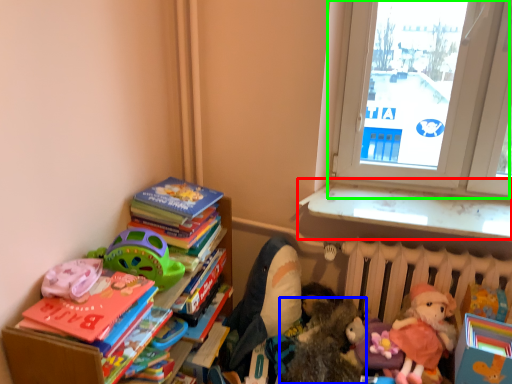
Question: Considering the real-world distances, which object is farthest from window sill (highlighted by a red box)? toy (highlighted by a blue box) or window (highlighted by a green box)?

Choices:
 (A) toy
 (B) window

Answer: (A)